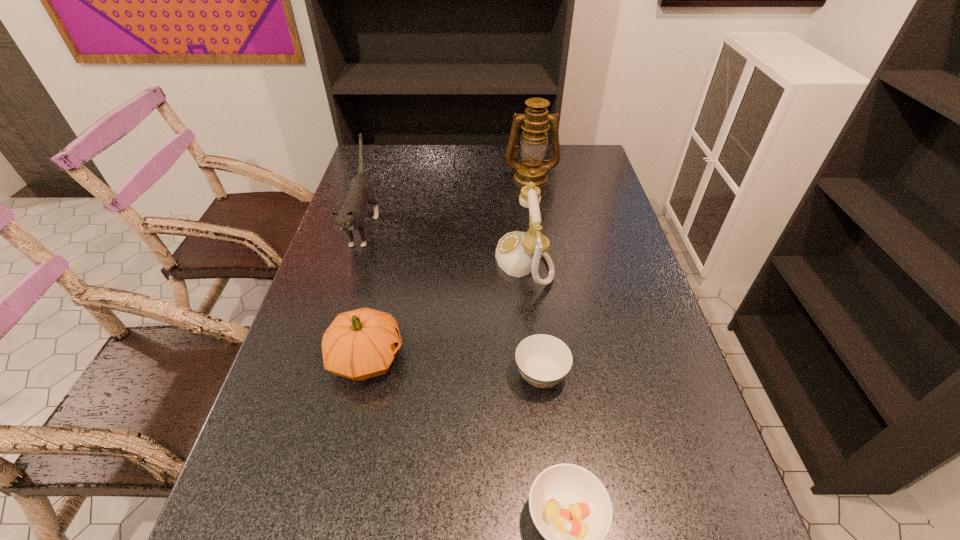
This screenshot has height=540, width=960. Identify the location of vacant space positioned 0.360m on the dial of the third tallest object. (370, 260).

In order to click on vacant space situated 0.110m on the side of the gourd with the carved face in this screenshot , I will do `click(453, 358)`.

Locate an element on the screen. This screenshot has height=540, width=960. vacant area situated on the left of the farther soup bowl is located at coordinates (491, 375).

Identify the location of object that is at the far edge. (x=535, y=122).

This screenshot has width=960, height=540. What are the coordinates of `cat at the left edge` in the screenshot? It's located at (350, 217).

This screenshot has height=540, width=960. In order to click on gourd that is at the left edge in this screenshot , I will do `click(359, 344)`.

At what (x,y) coordinates should I click in order to perform the action: click on blank area at the far edge. Please return your answer as a coordinate pair (x, y). This screenshot has width=960, height=540. Looking at the image, I should click on (426, 170).

Where is `free space at the left edge of the desktop`? This screenshot has height=540, width=960. free space at the left edge of the desktop is located at coordinates (312, 432).

Identify the location of vacant space at the right edge of the desktop. (695, 415).

This screenshot has width=960, height=540. Identify the location of vacant area at the far right corner of the desktop. (582, 146).